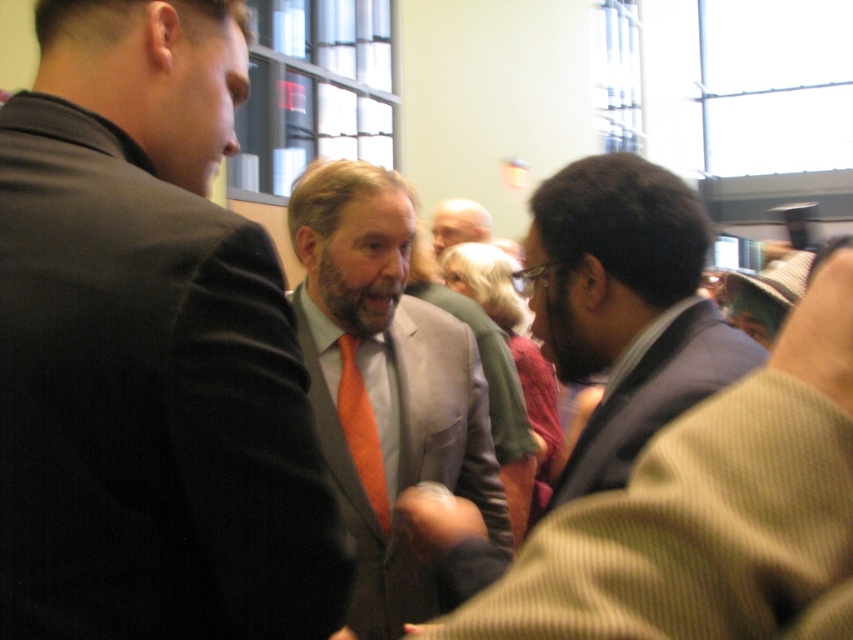
Can you confirm if matte gray suit at center is positioned above dark brown suit at center?

No, matte gray suit at center is not above dark brown suit at center.

Is matte gray suit at center to the left of dark brown suit at center from the viewer's perspective?

Correct, you'll find matte gray suit at center to the left of dark brown suit at center.

Which is behind, point (323, 236) or point (589, 244)?

Point (323, 236)

Where is `matte gray suit at center`? This screenshot has height=640, width=853. matte gray suit at center is located at coordinates (384, 381).

Is dark brown suit at center above orange silk tie at center?

No, dark brown suit at center is not above orange silk tie at center.

Is the position of dark brown suit at center less distant than that of orange silk tie at center?

Yes, it is in front of orange silk tie at center.

Does point (676, 403) come farther from viewer compared to point (480, 208)?

No, it is not.

The height and width of the screenshot is (640, 853). Find the location of `dark brown suit at center`. dark brown suit at center is located at coordinates (625, 307).

Is point (212, 548) positioned after point (471, 221)?

No, it is in front of (471, 221).

Is orange tie at center taller than orange silk tie at center?

Yes.

Does point (113, 416) come farther from viewer compared to point (460, 240)?

No, (113, 416) is in front of (460, 240).

The width and height of the screenshot is (853, 640). I want to click on orange tie at center, so click(148, 349).